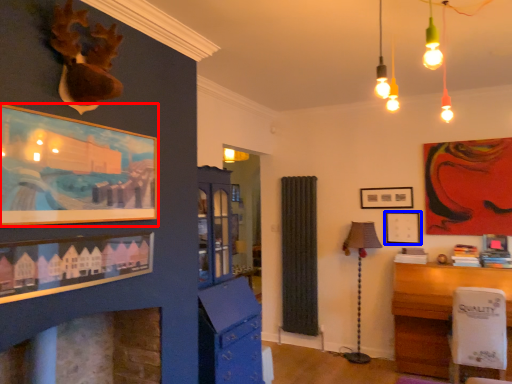
Question: Which object is further to the camera taking this photo, picture frame (highlighted by a red box) or picture frame (highlighted by a blue box)?

Choices:
 (A) picture frame
 (B) picture frame

Answer: (B)